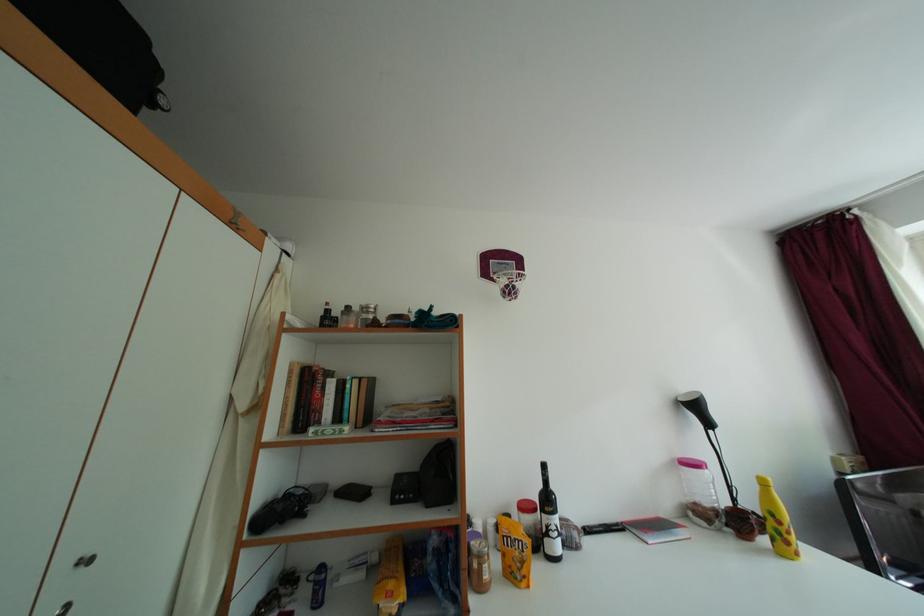
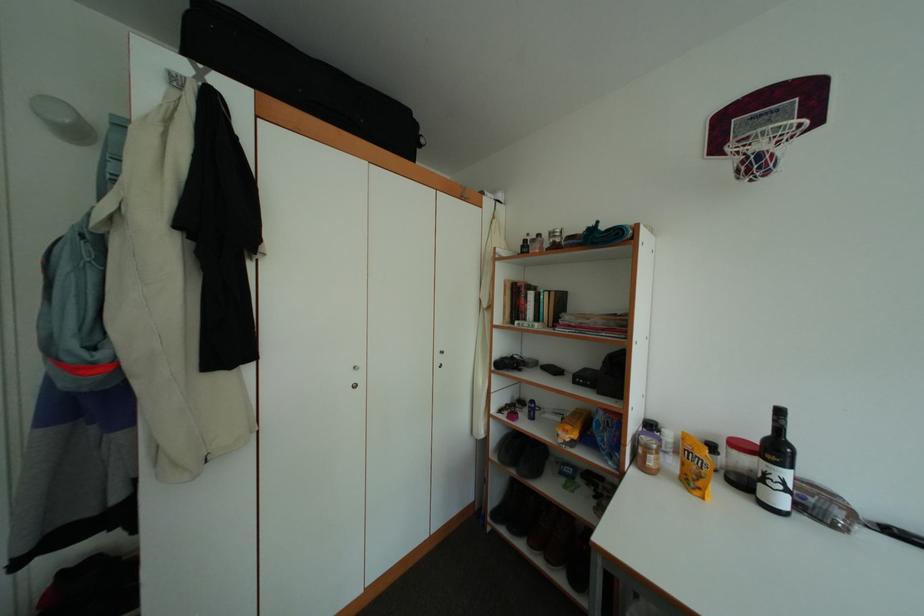
Question: How did the camera likely rotate?

Choices:
 (A) Left
 (B) Right
 (C) Up
 (D) Down

Answer: (A)